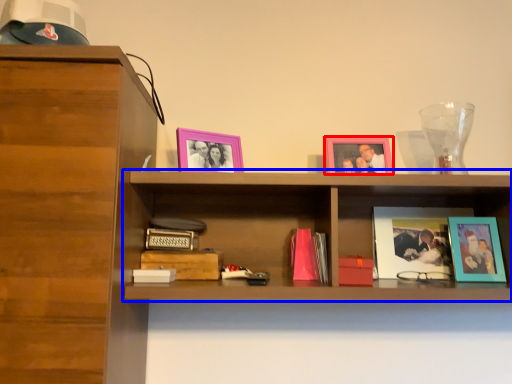
Question: Which object is further to the camera taking this photo, picture frame (highlighted by a red box) or shelf (highlighted by a blue box)?

Choices:
 (A) picture frame
 (B) shelf

Answer: (A)